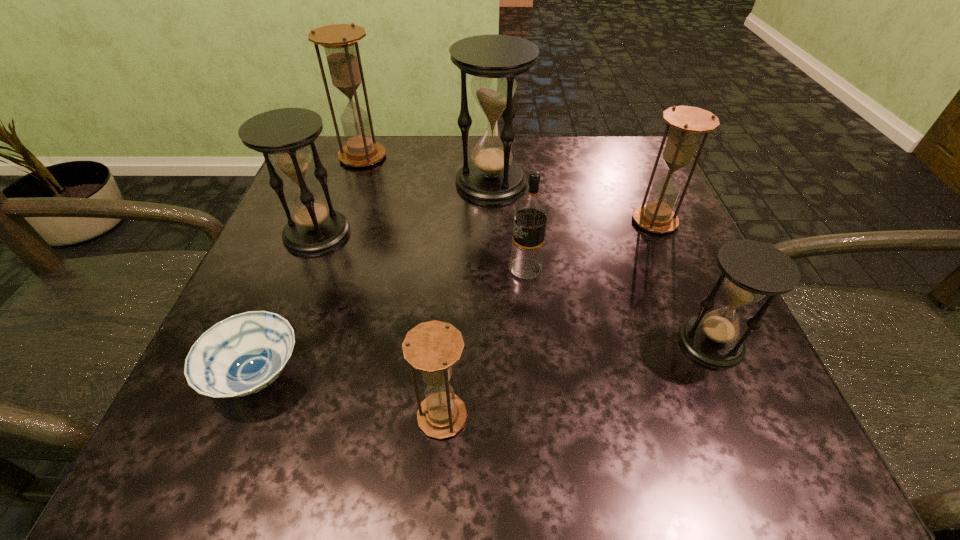
In order to click on the biggest brown hourglass in this screenshot , I will do `click(340, 43)`.

In order to click on the leftmost brown hourglass in this screenshot , I will do `click(340, 43)`.

The height and width of the screenshot is (540, 960). In order to click on the farthest black hourglass in this screenshot , I will do `click(491, 177)`.

Locate an element on the screen. the biggest black hourglass is located at coordinates click(491, 177).

Find the location of `the second farthest brown hourglass`. the second farthest brown hourglass is located at coordinates (687, 123).

Locate an element on the screen. Image resolution: width=960 pixels, height=540 pixels. the second smallest brown hourglass is located at coordinates (687, 123).

I want to click on the leftmost black hourglass, so click(x=284, y=136).

Where is `the second smallest black hourglass`? The image size is (960, 540). the second smallest black hourglass is located at coordinates (284, 136).

At what (x,y) coordinates should I click in order to perform the action: click on the fifth farthest object. Please return your answer as a coordinate pair (x, y). Looking at the image, I should click on tap(531, 211).

I want to click on the smallest brown hourglass, so click(432, 347).